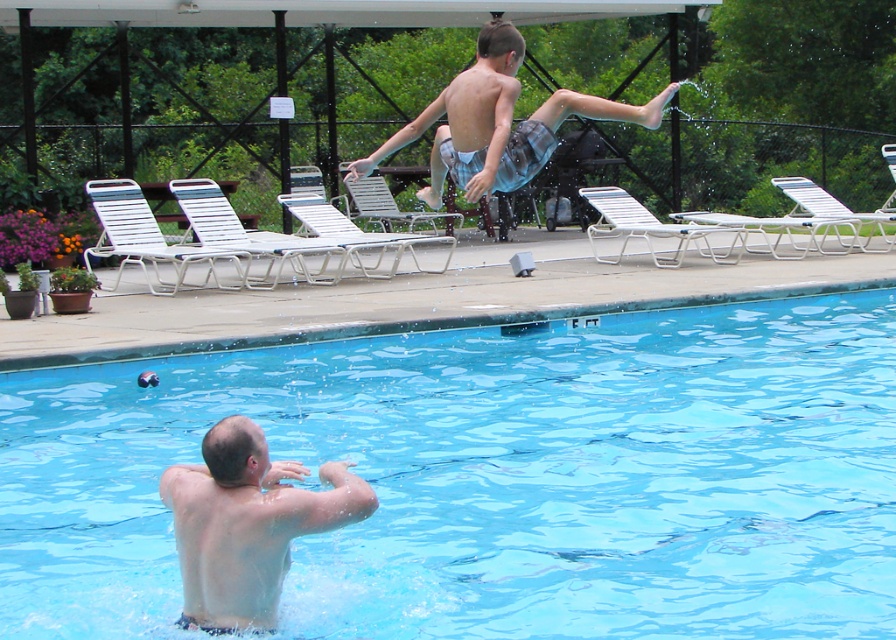
Question: Which of the following is the closest to the observer?

Choices:
 (A) (838, 538)
 (B) (269, 552)

Answer: (B)

Question: Which of the following is the farthest from the observer?

Choices:
 (A) pale skin at upper center
 (B) light blue plaid shorts at upper center

Answer: (B)

Question: Can you confirm if transparent blue water at center is positioned to the left of pale skin at upper center?

Choices:
 (A) yes
 (B) no

Answer: (B)

Question: Considering the relative positions of pale skin at upper center and light blue plaid shorts at upper center in the image provided, where is pale skin at upper center located with respect to light blue plaid shorts at upper center?

Choices:
 (A) above
 (B) below

Answer: (B)

Question: Does pale skin at upper center appear under light blue plaid shorts at upper center?

Choices:
 (A) no
 (B) yes

Answer: (B)

Question: Which object appears closest to the camera in this image?

Choices:
 (A) light blue plaid shorts at upper center
 (B) transparent blue water at center
 (C) pale skin at upper center

Answer: (C)